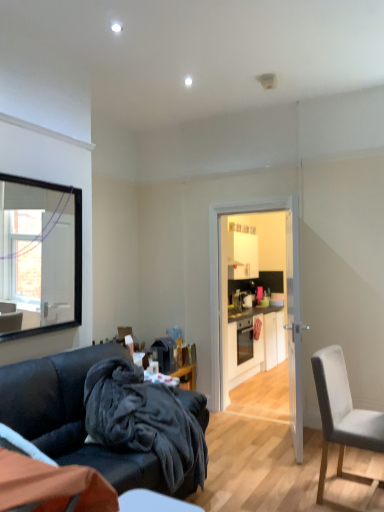
The width and height of the screenshot is (384, 512). Find the location of `transparent glass door at center`. transparent glass door at center is located at coordinates (294, 328).

What is the approximate height of light gray fabric chair at right?

The height of light gray fabric chair at right is 35.69 inches.

Find the location of `transparent glass door at center`. transparent glass door at center is located at coordinates (294, 328).

Consider the image. Is white glossy door at center aimed at dark fleece blanket at lower left?

Yes, white glossy door at center is turned towards dark fleece blanket at lower left.

Can you tell me how much white glossy door at center and dark fleece blanket at lower left differ in facing direction?

There is a 80.6-degree angle between the facing directions of white glossy door at center and dark fleece blanket at lower left.

Does white glossy door at center have a greater width compared to dark fleece blanket at lower left?

No.

Considering the relative sizes of white glossy door at center and dark fleece blanket at lower left in the image provided, is white glossy door at center smaller than dark fleece blanket at lower left?

Incorrect, white glossy door at center is not smaller in size than dark fleece blanket at lower left.

In the scene shown: From a real-world perspective, between light gray fabric chair at right and transparent glass door at center, who is vertically higher?

transparent glass door at center is physically above.

Identify the location of chair lying in front of the transparent glass door at center. Image resolution: width=384 pixels, height=512 pixels. (343, 417).

Which is nearer, (334, 358) or (290, 277)?

Point (334, 358)

Is point (22, 381) behind point (368, 433)?

No, it is not.

Is velvet dark blue couch at lower left turned away from light gray fabric chair at right?

No, velvet dark blue couch at lower left is not facing the opposite direction of light gray fabric chair at right.

Which is further, (178, 411) or (53, 457)?

The point (178, 411) is behind.

Does dark fleece blanket at lower left come in front of velvet dark blue couch at lower left?

No, dark fleece blanket at lower left is further to the viewer.

Does dark fleece blanket at lower left appear on the left side of velvet dark blue couch at lower left?

Incorrect, dark fleece blanket at lower left is not on the left side of velvet dark blue couch at lower left.

Considering the sizes of objects dark fleece blanket at lower left and velvet dark blue couch at lower left in the image provided, who is smaller, dark fleece blanket at lower left or velvet dark blue couch at lower left?

With smaller size is dark fleece blanket at lower left.

From the image's perspective, is velvet dark blue couch at lower left located beneath transparent glass door at center?

Indeed, from the image's perspective, velvet dark blue couch at lower left is shown beneath transparent glass door at center.

From a real-world perspective, which is physically below, velvet dark blue couch at lower left or transparent glass door at center?

velvet dark blue couch at lower left, from a real-world perspective.

Is velvet dark blue couch at lower left positioned with its back to transparent glass door at center?

That's not correct — velvet dark blue couch at lower left is not looking away from transparent glass door at center.

Who is smaller, velvet dark blue couch at lower left or matte black cabinets at center?

matte black cabinets at center.

At what (x,y) coordinates should I click in order to perform the action: click on cabinetry that appears below the velvet dark blue couch at lower left (from the image's perspective). Please return your answer as a coordinate pair (x, y). Looking at the image, I should click on (256, 343).

Based on the photo, from the image's perspective, which is below, velvet dark blue couch at lower left or matte black cabinets at center?

matte black cabinets at center is shown below in the image.

Which point is more distant from viewer, (179, 390) or (282, 347)?

The point (282, 347) is behind.

Which is more to the right, light gray fabric chair at right or velvet dark blue couch at lower left?

Positioned to the right is light gray fabric chair at right.

Based on the photo, are light gray fabric chair at right and velvet dark blue couch at lower left far apart?

That's right, there is a large distance between light gray fabric chair at right and velvet dark blue couch at lower left.

Which object is thinner, light gray fabric chair at right or velvet dark blue couch at lower left?

light gray fabric chair at right.

Identify the location of blanket on the left of white glossy door at center. Image resolution: width=384 pixels, height=512 pixels. (144, 420).

Image resolution: width=384 pixels, height=512 pixels. What are the coordinates of `glass door above the light gray fabric chair at right (from the image's perspective)` in the screenshot? It's located at (294, 328).

Based on their spatial positions, is white glossy door at center or matte black cabinets at center further from dark fleece blanket at lower left?

matte black cabinets at center lies further to dark fleece blanket at lower left than the other object.

Estimate the real-world distances between objects in this image. Which object is closer to light gray fabric chair at right, dark fleece blanket at lower left or velvet dark blue couch at lower left?

dark fleece blanket at lower left is positioned closer to the anchor light gray fabric chair at right.

Which object lies nearer to the anchor point light gray fabric chair at right, matte black cabinets at center or transparent glass door at center?

transparent glass door at center is positioned closer to the anchor light gray fabric chair at right.

Estimate the real-world distances between objects in this image. Which object is further from transparent glass door at center, dark fleece blanket at lower left or velvet dark blue couch at lower left?

Among the two, velvet dark blue couch at lower left is located further to transparent glass door at center.

Based on their spatial positions, is velvet dark blue couch at lower left or light gray fabric chair at right closer to matte black cabinets at center?

The object closer to matte black cabinets at center is light gray fabric chair at right.

Based on their spatial positions, is transparent glass door at center or matte black cabinets at center closer to dark fleece blanket at lower left?

The object closer to dark fleece blanket at lower left is transparent glass door at center.

In the scene shown: Based on their spatial positions, is transparent glass door at center or velvet dark blue couch at lower left closer to light gray fabric chair at right?

transparent glass door at center.

Consider the image. Looking at the image, which one is located further to transparent glass door at center, matte black cabinets at center or light gray fabric chair at right?

matte black cabinets at center is further to transparent glass door at center.

Where is `blanket positioned between light gray fabric chair at right and matte black cabinets at center from near to far`? blanket positioned between light gray fabric chair at right and matte black cabinets at center from near to far is located at coordinates (144, 420).

At what (x,y) coordinates should I click in order to perform the action: click on glass door between velvet dark blue couch at lower left and white glossy door at center in the front-back direction. Please return your answer as a coordinate pair (x, y). Image resolution: width=384 pixels, height=512 pixels. Looking at the image, I should click on (294, 328).

Identify the location of chair positioned between velvet dark blue couch at lower left and matte black cabinets at center from near to far. This screenshot has width=384, height=512. (343, 417).

You are a GUI agent. You are given a task and a screenshot of the screen. Output one action in this format:
    pyautogui.click(x=<x>, y=<y>)
    Task: Click on the blanket between velvet dark blue couch at lower left and white glossy door at center from front to back
    This screenshot has height=512, width=384.
    Given the screenshot: What is the action you would take?
    pyautogui.click(x=144, y=420)